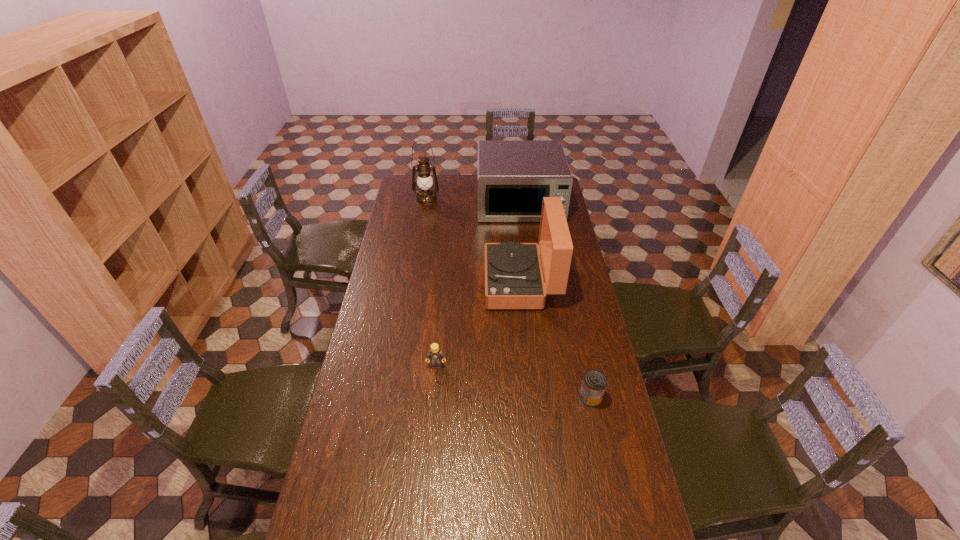
Where is `the leftmost object`? This screenshot has width=960, height=540. the leftmost object is located at coordinates (426, 195).

You are a GUI agent. You are given a task and a screenshot of the screen. Output one action in this format:
    pyautogui.click(x=<x>, y=<y>)
    Task: Click on the phonograph record
    The width and height of the screenshot is (960, 540).
    Given the screenshot: What is the action you would take?
    pyautogui.click(x=513, y=278)

I want to click on the third tallest object, so click(513, 175).

Identify the location of the fourth object from right to left. (436, 356).

At what (x,y) coordinates should I click in order to perform the action: click on the second nearest object. Please return your answer as a coordinate pair (x, y). Looking at the image, I should click on [x=436, y=356].

Find the location of a particular element. This screenshot has width=960, height=540. the shortest object is located at coordinates (594, 383).

In order to click on can in this screenshot , I will do `click(594, 383)`.

You are a GUI agent. You are given a task and a screenshot of the screen. Output one action in this format:
    pyautogui.click(x=<x>, y=<y>)
    Task: Click on the vacant point located on the front of the oil lamp
    
    Given the screenshot: What is the action you would take?
    pyautogui.click(x=420, y=239)

Locate an element on the screen. vacant space located 0.370m on the face of the third nearest object is located at coordinates (400, 282).

At what (x,y) coordinates should I click in order to perform the action: click on free location located 0.320m on the face of the third nearest object. Please return your answer as a coordinate pair (x, y). Looking at the image, I should click on (412, 282).